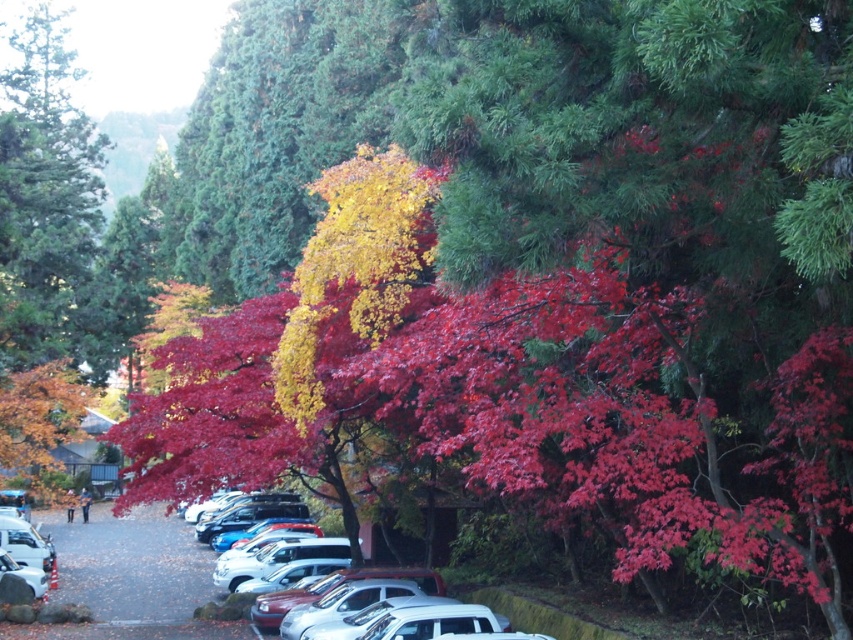
You are a photographer planning to capture the entire scene in one shot. Since the green matte tree at upper left and the white matte car at center are both in your frame, which object will appear narrower in your photo?

The green matte tree at upper left will appear narrower in the photo because its width is less than that of the white matte car at center.

You are a delivery person needing to park a 4.5 meter long delivery van between the white matte car at center and the white glossy car at lower left. Can you fit the van between them without touching either car?

The white matte car at center and white glossy car at lower left are 8.53 meters apart from each other. Since the delivery van is 4.5 meters long, there is enough space between the two cars to park the van without touching either car.

You are standing at the center of the parking area and want to take a photo of the green matte tree at upper left. Based on its 2D location coordinates, where should you position yourself to ensure the tree is centered in your camera view?

The green matte tree at upper left is located at coordinates (x=44, y=195). To center it in your camera view, position yourself so that the camera is aimed directly at those coordinates, ensuring the tree is at the center of the frame.